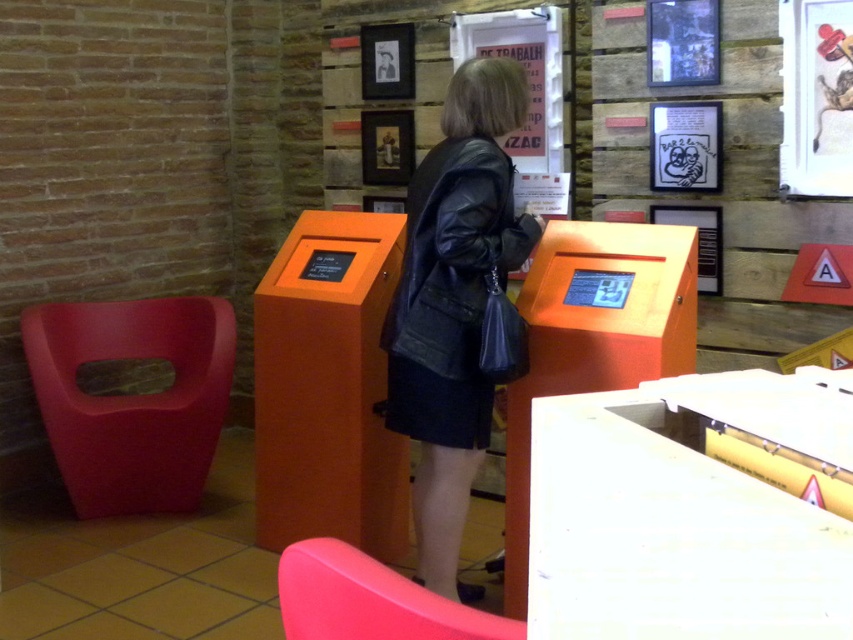
You are a visitor in the museum and see the black leather jacket at center and the matte black poster at upper center. Which object is positioned lower in the scene?

The black leather jacket at center is positioned lower than the matte black poster at upper center.

You are a visitor in the museum and want to sit down on the matte plastic chair at lower left to read the wooden framed poster at center. Can you comfortably read the poster while sitting on the chair?

The distance between the matte plastic chair at lower left and the wooden framed poster at center is 8.16 feet. Since this distance is quite far, it might be difficult to comfortably read the poster while sitting on the chair.

You are standing in the museum and need to reach both points in the image. Which point, point (383, 627) or point (474, 28), is closer to you?

Point (383, 627) is closer to the viewer than point (474, 28).